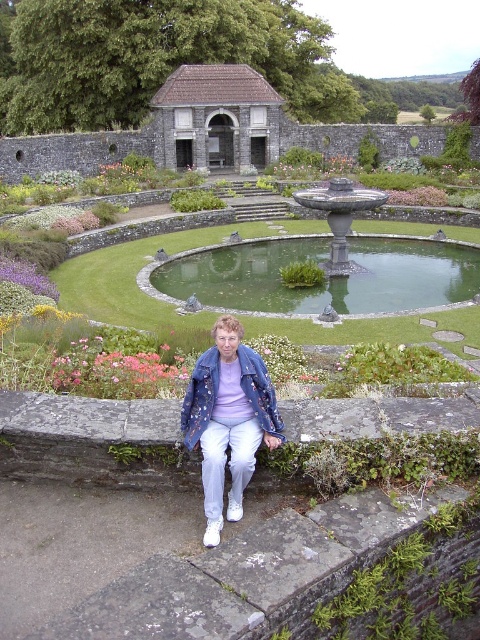
Is point (206, 536) less distant than point (132, 380)?

Yes, point (206, 536) is closer to viewer.

Who is more forward, (247, 355) or (73, 353)?

Point (247, 355) is in front.

Does point (218, 515) lie behind point (70, 392)?

No, it is in front of (70, 392).

The image size is (480, 640). Find the location of `denim jacket at lower center`. denim jacket at lower center is located at coordinates (228, 419).

Who is more forward, (235,460) or (21,275)?

Point (235,460) is in front.

Which is below, denim jacket at lower center or purple matte flower at lower left?

denim jacket at lower center is below.

Is point (211, 492) closer to viewer compared to point (27, 284)?

Yes, point (211, 492) is closer to viewer.

This screenshot has height=640, width=480. Identify the location of denim jacket at lower center. (228, 419).

Can you confirm if green stone pond at center is positioned below denim jacket at lower center?

No.

Does green stone pond at center come behind denim jacket at lower center?

Yes, green stone pond at center is further from the viewer.

The image size is (480, 640). Find the location of `green stone pond at center`. green stone pond at center is located at coordinates (327, 280).